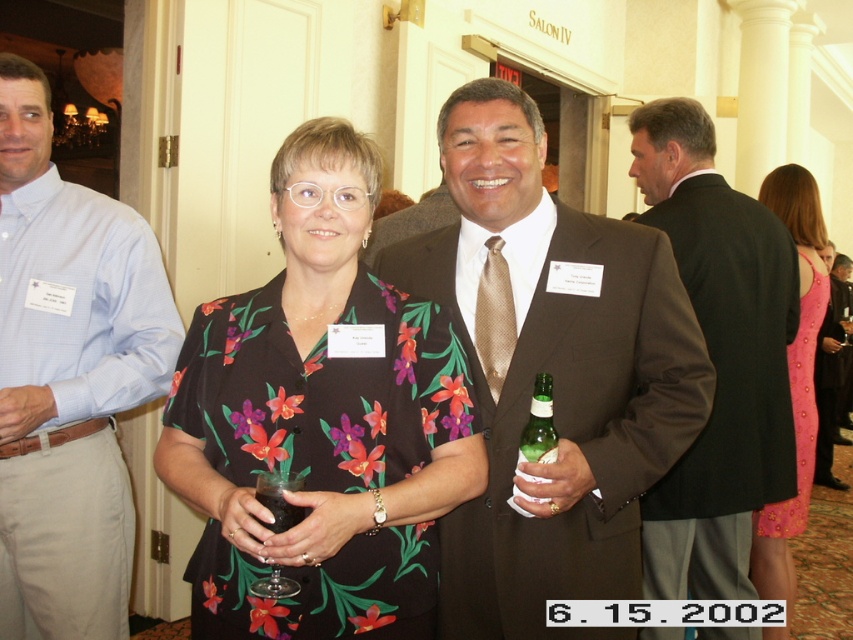
Question: In this image, where is floral print blouse at center located relative to black suit at right?

Choices:
 (A) right
 (B) left

Answer: (B)

Question: Does floral print blouse at center appear on the left side of pink satin dress at right?

Choices:
 (A) yes
 (B) no

Answer: (A)

Question: Based on their relative distances, which object is nearer to the pink satin dress at right?

Choices:
 (A) floral print blouse at center
 (B) green glass bottle at center
 (C) light blue checkered shirt at left

Answer: (B)

Question: Which point is farther from the camera taking this photo?

Choices:
 (A) (376, 528)
 (B) (653, 520)

Answer: (B)

Question: Which point is closer to the camera?

Choices:
 (A) (677, 556)
 (B) (12, 179)

Answer: (B)

Question: Observing the image, what is the correct spatial positioning of light blue checkered shirt at left in reference to green glass bottle at center?

Choices:
 (A) right
 (B) left

Answer: (B)